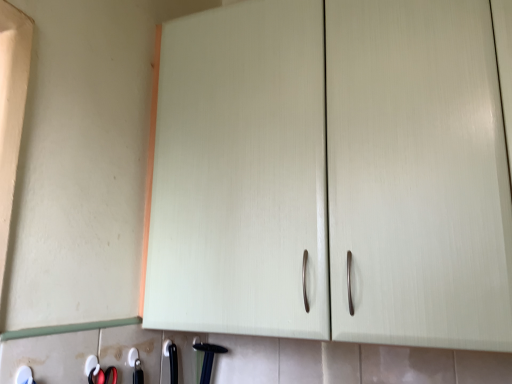
Question: Visually, is black plastic hammer at lower center positioned to the left or to the right of white plastic tool at lower left?

Choices:
 (A) right
 (B) left

Answer: (A)

Question: From the image's perspective, is black plastic hammer at lower center located above or below white plastic tool at lower left?

Choices:
 (A) below
 (B) above

Answer: (A)

Question: Would you say black plastic hammer at lower center is inside or outside white plastic tool at lower left?

Choices:
 (A) outside
 (B) inside

Answer: (A)

Question: Would you say white plastic tool at lower left is inside or outside black plastic hammer at lower center?

Choices:
 (A) outside
 (B) inside

Answer: (A)

Question: From a real-world perspective, is white plastic tool at lower left above or below black plastic hammer at lower center?

Choices:
 (A) below
 (B) above

Answer: (B)

Question: Considering the positions of point (31, 377) and point (202, 367), is point (31, 377) closer or farther from the camera than point (202, 367)?

Choices:
 (A) farther
 (B) closer

Answer: (B)

Question: Is white plastic tool at lower left in front of or behind black plastic hammer at lower center in the image?

Choices:
 (A) behind
 (B) front

Answer: (B)